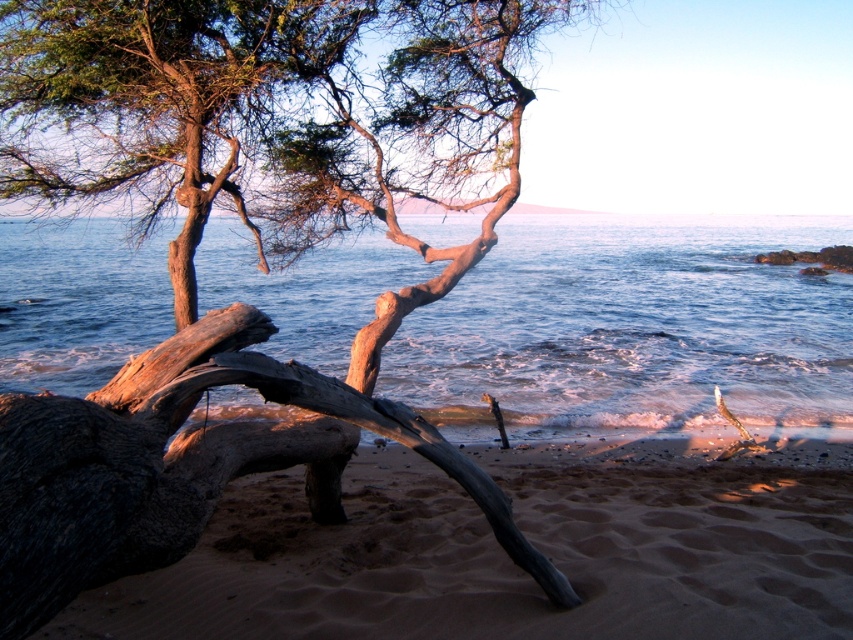
You are standing on the beach looking at the driftwood and the ocean. There are two points marked on the image. The first point is at coordinates point (213,280) and the second point is at point (379,611). Which point is closer to you?

Point (213,280) is further to the camera than point (379,611), so the second point is closer to you.